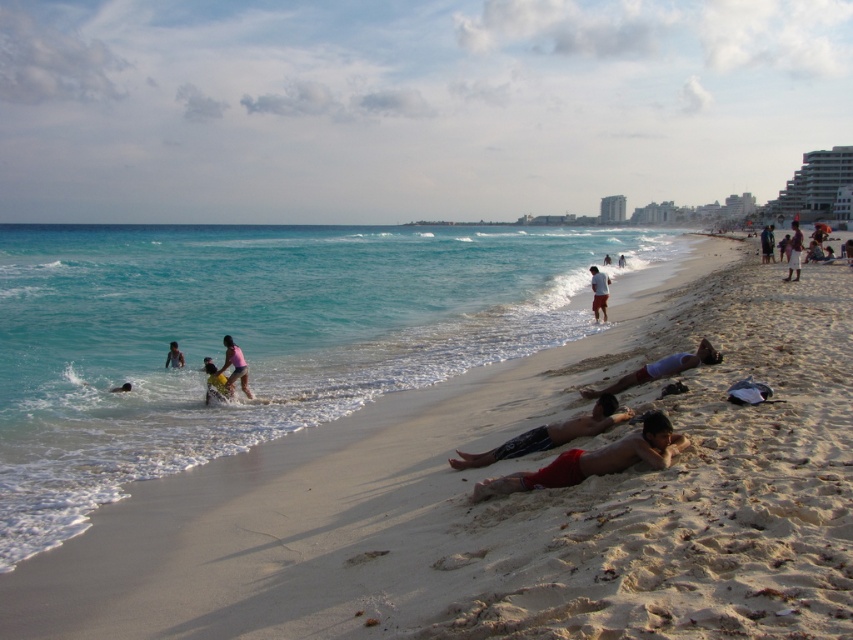
You are standing at the edge of the beach and want to walk to both the point at coordinates (613, 412) and the point at (607, 262). Which point will you reach first?

The point at coordinates (613, 412) will be reached first because it is closer to the viewer than the point at (607, 262).

You are a photographer trying to capture a wide shot of the beach scene. You want to include both the light brown sand at right and the matte white surfboard at center in your frame. However, your camera has a limited field of view. Which object should you prioritize to ensure it fits in the frame?

The light brown sand at right is bigger than the matte white surfboard at center, so you should prioritize including the light brown sand at right in the frame to ensure it fits within the limited field of view.